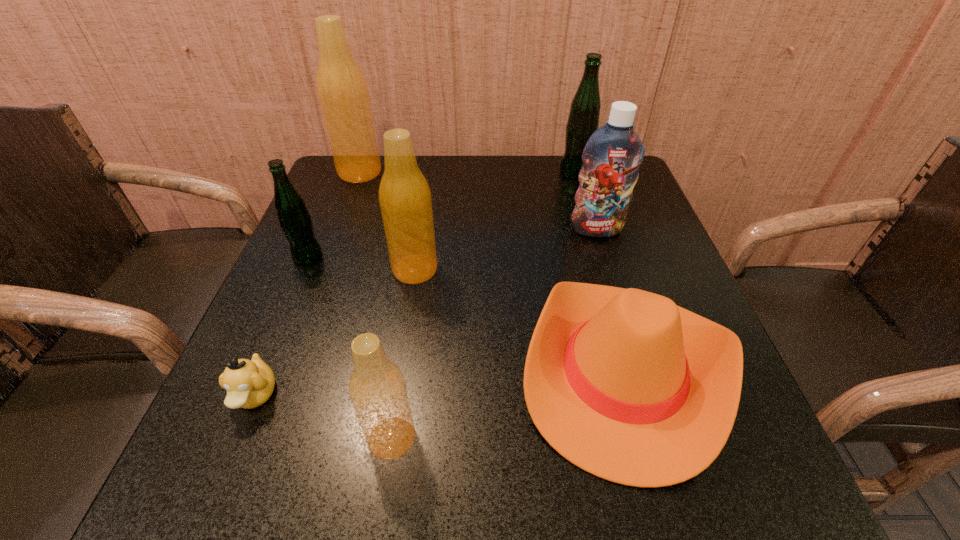
At what (x,y) coordinates should I click in order to perform the action: click on vacant space positioned 0.380m on the left of the cowboy hat. Please return your answer as a coordinate pair (x, y). Image resolution: width=960 pixels, height=540 pixels. Looking at the image, I should click on (293, 370).

At what (x,y) coordinates should I click in order to perform the action: click on free space located on the face of the tan duckling. Please return your answer as a coordinate pair (x, y). Image resolution: width=960 pixels, height=540 pixels. Looking at the image, I should click on (209, 508).

Where is `beer bottle at the near edge`? beer bottle at the near edge is located at coordinates (377, 388).

Find the location of a particular element. Image resolution: width=960 pixels, height=540 pixels. cowboy hat at the near edge is located at coordinates (623, 383).

At what (x,y) coordinates should I click in order to perform the action: click on duckling that is at the left edge. Please return your answer as a coordinate pair (x, y). This screenshot has width=960, height=540. Looking at the image, I should click on (249, 383).

Where is `beer bottle that is at the right edge`? The image size is (960, 540). beer bottle that is at the right edge is located at coordinates (583, 120).

This screenshot has width=960, height=540. I want to click on shampoo that is positioned at the right edge, so click(x=611, y=158).

The width and height of the screenshot is (960, 540). I want to click on cowboy hat that is at the right edge, so (x=623, y=383).

Image resolution: width=960 pixels, height=540 pixels. In order to click on object that is positioned at the far left corner in this screenshot , I will do `click(342, 90)`.

The height and width of the screenshot is (540, 960). Identify the location of object that is at the far right corner. (583, 120).